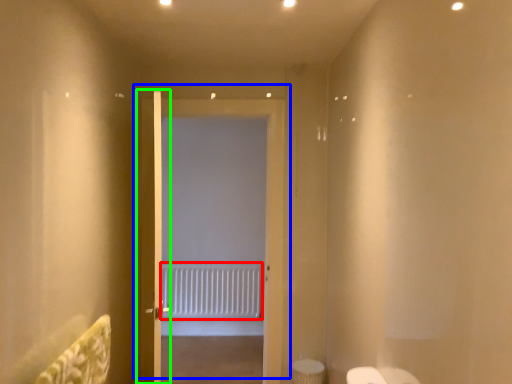
Question: Which object is positioned closest to radiator (highlighted by a red box)? Select from door (highlighted by a blue box) and door (highlighted by a green box).

Choices:
 (A) door
 (B) door

Answer: (A)